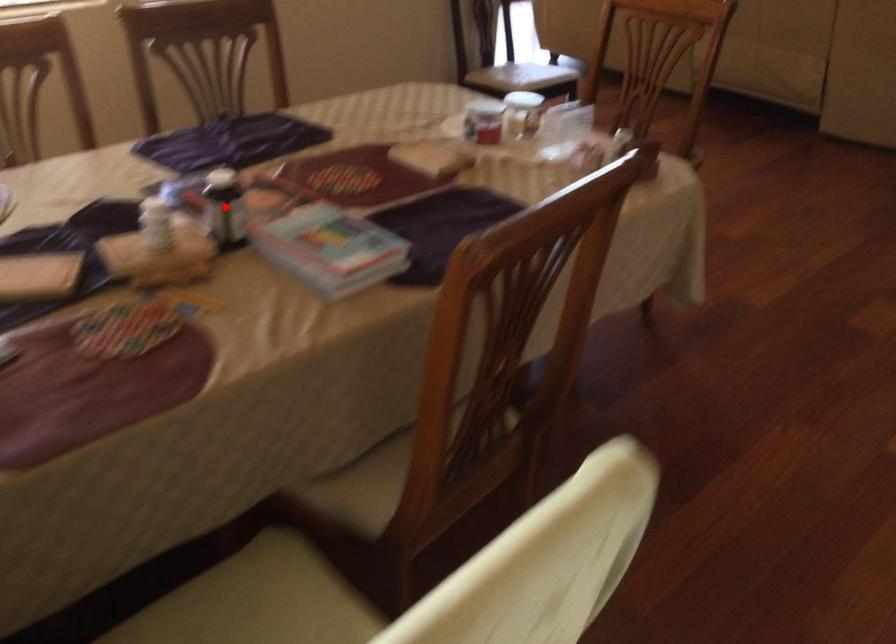
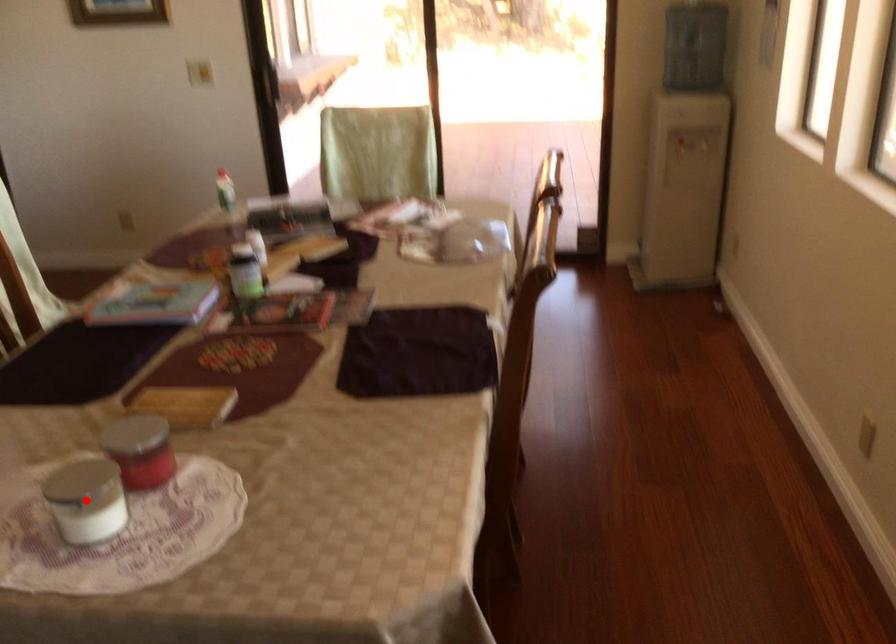
I am providing you with two images of the same scene from different viewpoints. A red point is marked on the first image and another point is marked on the second image. Are the points marked in image1 and image2 representing the same 3D position?

No